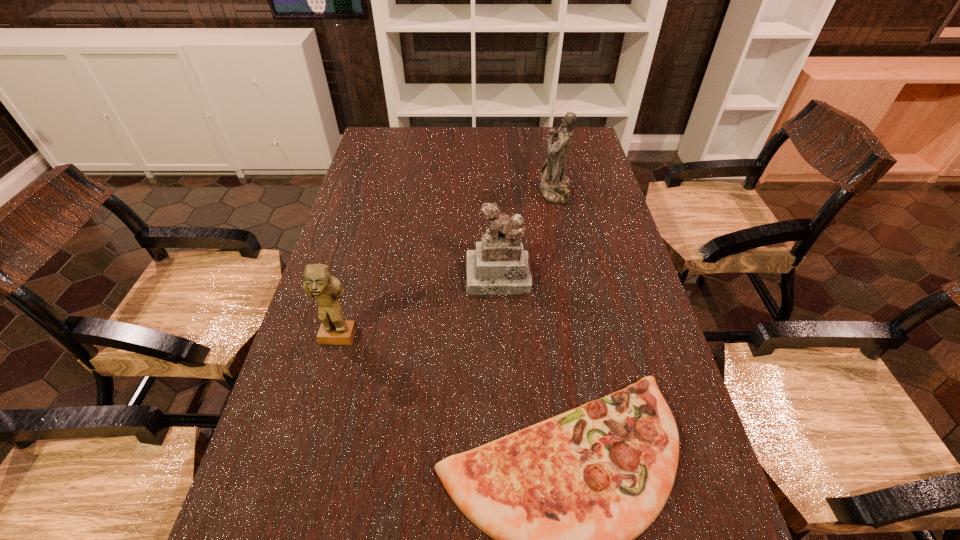
Identify the location of empty space between the second figurine from right to left and the farthest object. (527, 234).

Identify which object is the second closest to the rightmost figurine. Please provide its 2D coordinates. Your answer should be formatted as a tuple, i.e. [(x, y)], where the tuple contains the x and y coordinates of a point satisfying the conditions above.

[(564, 499)]

At what (x,y) coordinates should I click in order to perform the action: click on object that stands as the second closest to the leftmost object. Please return your answer as a coordinate pair (x, y). The height and width of the screenshot is (540, 960). Looking at the image, I should click on (498, 266).

Identify the location of figurine that is the second closest to the leftmost object. The width and height of the screenshot is (960, 540). pyautogui.click(x=554, y=185).

Identify the location of the closest figurine to the second farthest object. This screenshot has height=540, width=960. (554, 185).

At what (x,y) coordinates should I click in order to perform the action: click on vacant space that satisfies the following two spatial constraints: 1. on the front-facing side of the farthest object; 2. on the front-facing side of the leftmost figurine. Please return your answer as a coordinate pair (x, y). The image size is (960, 540). Looking at the image, I should click on (584, 338).